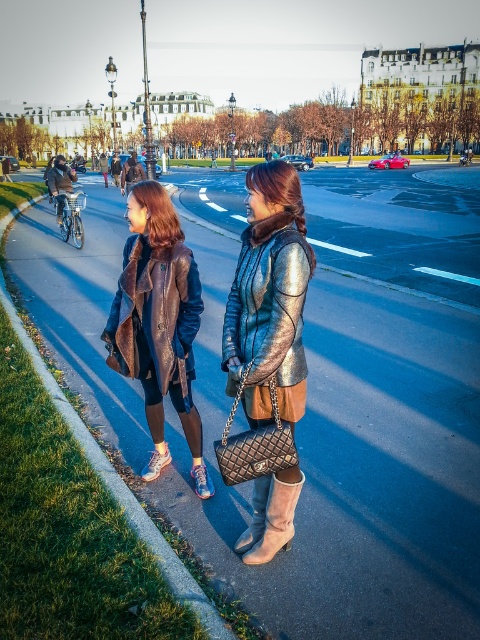
Question: Which is farther from the brown leather jacket at left?

Choices:
 (A) metallic silver jacket at center
 (B) smooth asphalt sidewalk at lower left
 (C) leather boot at lower center
 (D) suede boot at lower center

Answer: (B)

Question: Among these points, which one is nearest to the camera?

Choices:
 (A) (262, 506)
 (B) (460, 525)
 (C) (303, 230)
 (D) (266, 520)

Answer: (C)

Question: In this image, where is metallic silver jacket at center located relative to leather boot at lower center?

Choices:
 (A) below
 (B) above

Answer: (B)

Question: Among these objects, which one is nearest to the camera?

Choices:
 (A) leather boot at lower center
 (B) metallic silver jacket at center
 (C) brown leather jacket at left

Answer: (B)

Question: Does metallic silver jacket at center have a greater width compared to leather boot at lower center?

Choices:
 (A) yes
 (B) no

Answer: (A)

Question: Is smooth asphalt sidewalk at lower left above metallic silver jacket at center?

Choices:
 (A) no
 (B) yes

Answer: (B)